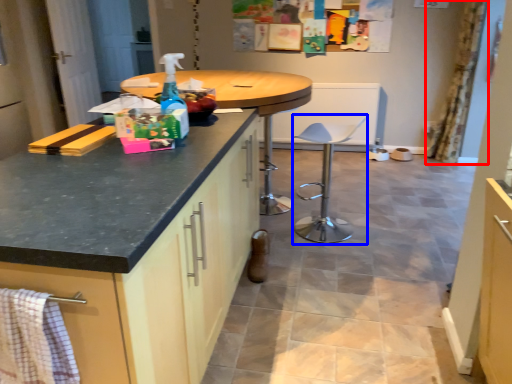
Question: Which object appears farthest to the camera in this image, curtain (highlighted by a red box) or swivel chair (highlighted by a blue box)?

Choices:
 (A) curtain
 (B) swivel chair

Answer: (A)